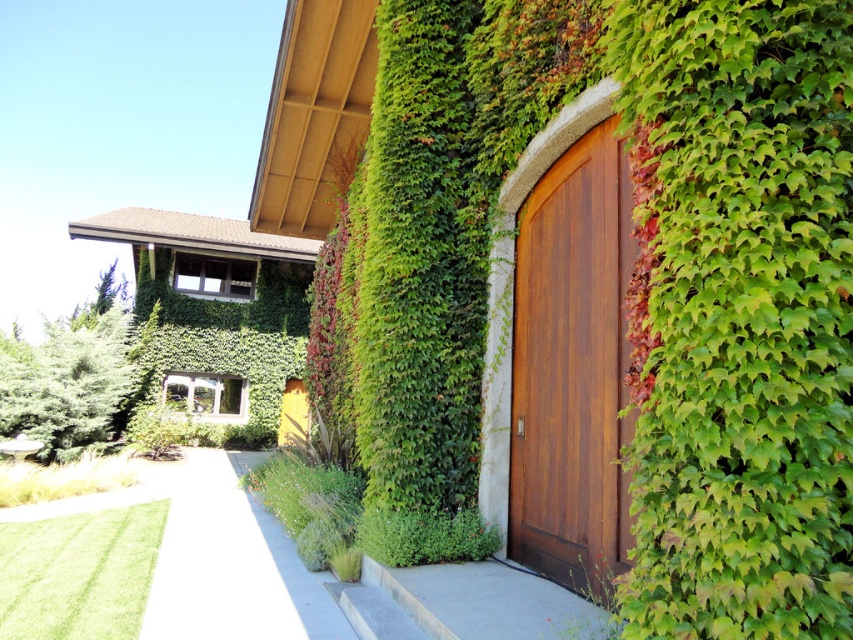
Can you confirm if white concrete path at lower center is positioned to the right of yellow matte door at center?

Incorrect, white concrete path at lower center is not on the right side of yellow matte door at center.

Who is positioned more to the left, white concrete path at lower center or yellow matte door at center?

white concrete path at lower center is more to the left.

Between point (248, 502) and point (292, 444), which one is positioned behind?

Positioned behind is point (292, 444).

This screenshot has width=853, height=640. Find the location of `white concrete path at lower center`. white concrete path at lower center is located at coordinates (231, 564).

Is point (607, 449) farther from camera compared to point (235, 580)?

No.

Can you confirm if shiny brown wood door at center is shorter than white concrete path at lower center?

No, shiny brown wood door at center is not shorter than white concrete path at lower center.

Describe the element at coordinates (572, 368) in the screenshot. The height and width of the screenshot is (640, 853). I see `shiny brown wood door at center` at that location.

Where is `shiny brown wood door at center`? The width and height of the screenshot is (853, 640). shiny brown wood door at center is located at coordinates (572, 368).

Which is in front, point (590, 568) or point (299, 387)?

Point (590, 568)

The height and width of the screenshot is (640, 853). Find the location of `shiny brown wood door at center`. shiny brown wood door at center is located at coordinates (572, 368).

At what (x,y) coordinates should I click in order to perform the action: click on shiny brown wood door at center. Please return your answer as a coordinate pair (x, y). The height and width of the screenshot is (640, 853). Looking at the image, I should click on (572, 368).